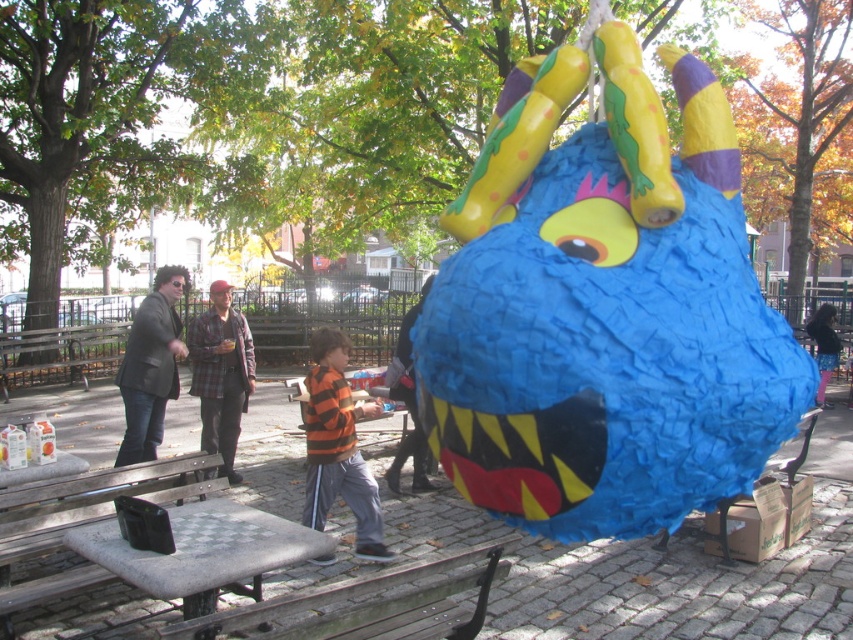
Question: Among these objects, which one is farthest from the camera?

Choices:
 (A) wooden bench at lower left
 (B) orange and black striped shirt at center

Answer: (B)

Question: Does orange striped hoodie at center have a smaller size compared to dark gray blazer at left?

Choices:
 (A) no
 (B) yes

Answer: (B)

Question: Is dark gray blazer at left positioned in front of wooden park bench at left?

Choices:
 (A) yes
 (B) no

Answer: (A)

Question: Which of the following is the farthest from the observer?

Choices:
 (A) (827, 365)
 (B) (117, 384)
 (C) (300, 419)

Answer: (A)

Question: Which object appears closest to the camera in this image?

Choices:
 (A) gray concrete picnic table at lower left
 (B) blue papier-mâché piñata at center
 (C) orange striped hoodie at center

Answer: (B)

Question: Does blue papier-mâché piñata at center have a smaller size compared to plaid flannel shirt at center?

Choices:
 (A) yes
 (B) no

Answer: (B)